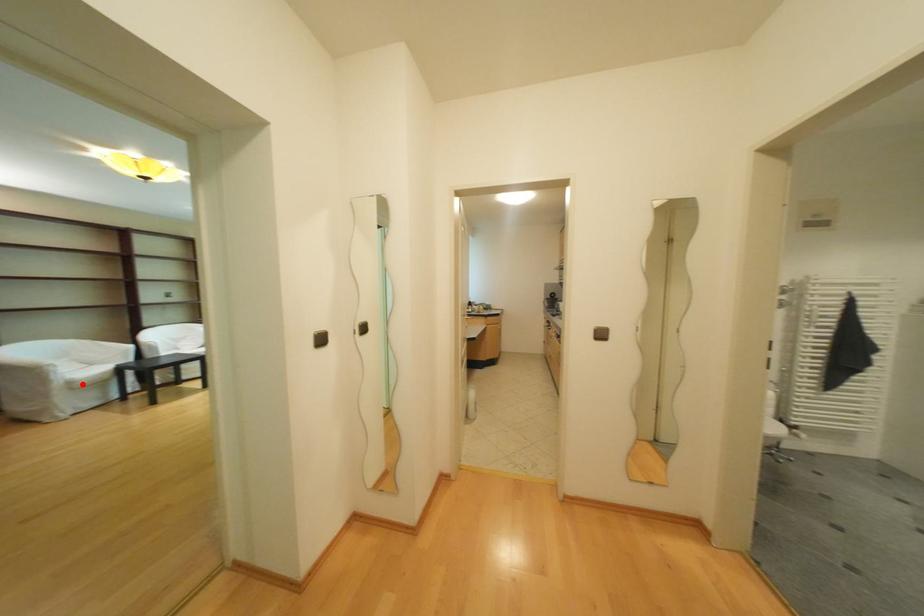
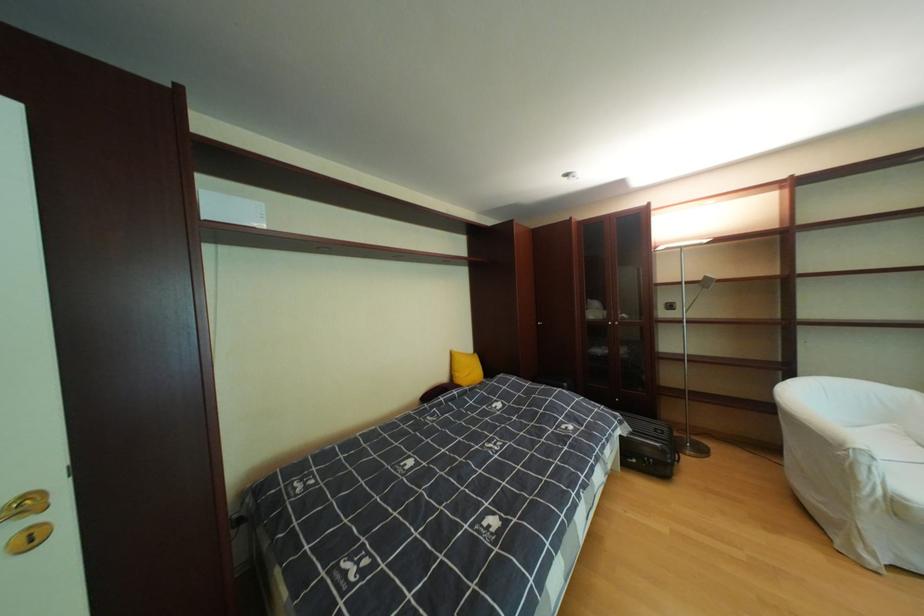
In the second image, find the point that corresponds to the highlighted location in the first image.

(908, 506)